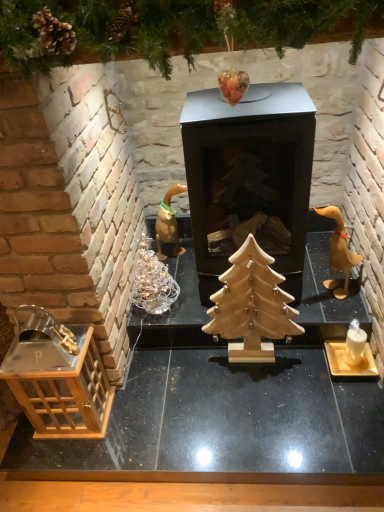
This screenshot has height=512, width=384. In order to click on free area in between natural wood christmas tree at center and matte gold candle holder at lower right in this screenshot , I will do `click(290, 367)`.